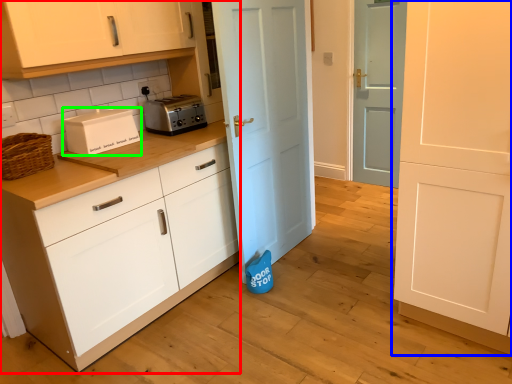
Question: Which is farther away from cabinetry (highlighted by a red box)? door (highlighted by a blue box) or home appliance (highlighted by a green box)?

Choices:
 (A) door
 (B) home appliance

Answer: (A)